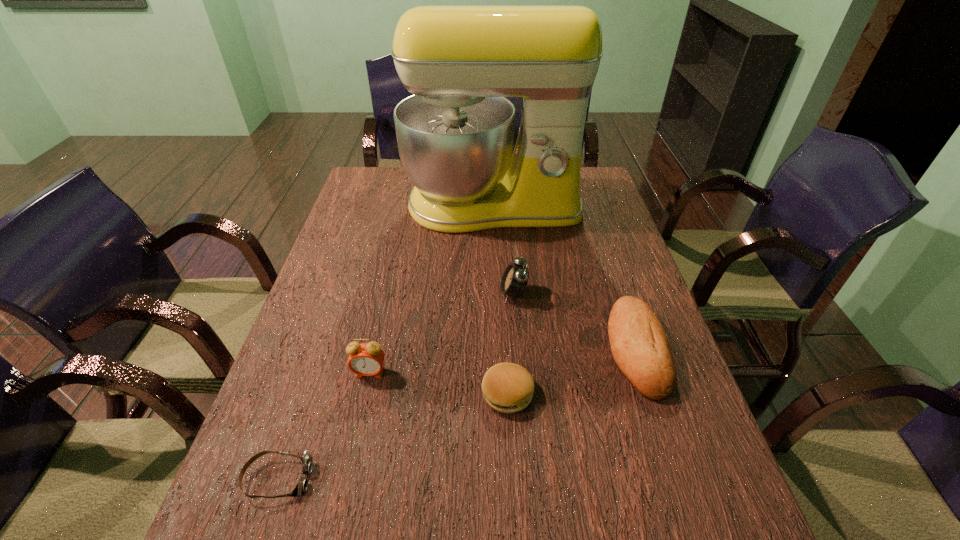
Find the location of a particular element. vacant space situated 0.350m on the face of the farther alarm clock is located at coordinates (370, 294).

The width and height of the screenshot is (960, 540). In order to click on free region located 0.170m on the face of the farther alarm clock in this screenshot , I will do `click(437, 294)`.

Where is `free space located on the face of the farther alarm clock`? The height and width of the screenshot is (540, 960). free space located on the face of the farther alarm clock is located at coordinates (463, 294).

The width and height of the screenshot is (960, 540). Find the location of `vacant space located on the face of the nearer alarm clock`. vacant space located on the face of the nearer alarm clock is located at coordinates (356, 433).

Find the location of a particular element. The height and width of the screenshot is (540, 960). vacant position located 0.220m on the front of the bread is located at coordinates (689, 511).

What are the coordinates of `vacant space located on the back of the fifth tallest object` in the screenshot? It's located at (503, 314).

I want to click on vacant space located on the front-facing side of the leftmost object, so click(x=488, y=478).

The height and width of the screenshot is (540, 960). What are the coordinates of `object that is at the far edge` in the screenshot? It's located at (455, 134).

What are the coordinates of `object positioned at the left edge` in the screenshot? It's located at (307, 460).

At what (x,y) coordinates should I click in order to perform the action: click on mixer present at the right edge. Please return your answer as a coordinate pair (x, y). The image size is (960, 540). Looking at the image, I should click on (455, 134).